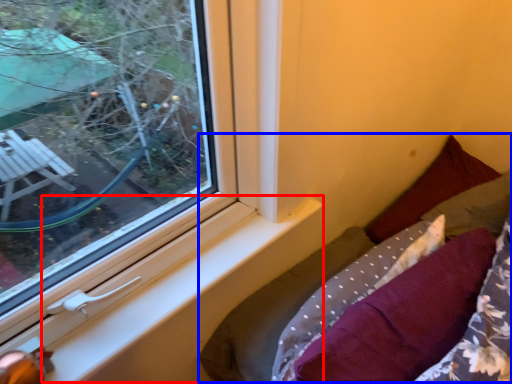
Question: Which object appears closest to the camera in this image, window sill (highlighted by a red box) or bed (highlighted by a blue box)?

Choices:
 (A) window sill
 (B) bed

Answer: (A)